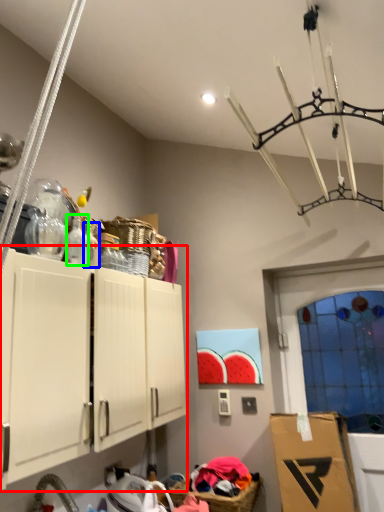
Question: Based on their relative distances, which object is farther from cabinetry (highlighted by a red box)? Choose from bottle (highlighted by a blue box) and bottle (highlighted by a green box).

Choices:
 (A) bottle
 (B) bottle

Answer: (A)